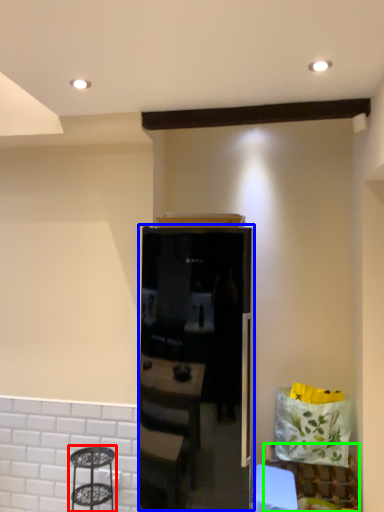
Question: Which is nearer to the step stool (highlighted by a red box)? appliance (highlighted by a blue box) or furniture (highlighted by a green box).

Choices:
 (A) appliance
 (B) furniture

Answer: (A)